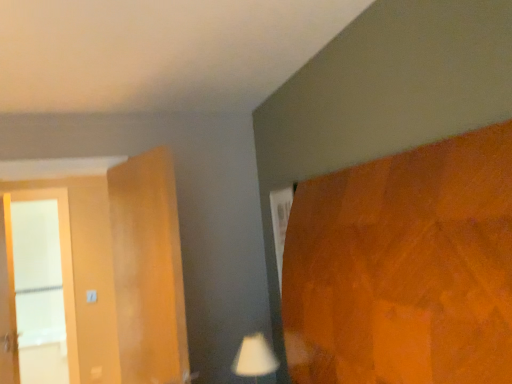
Find the location of `white matte table lamp at lower center`. white matte table lamp at lower center is located at coordinates (255, 357).

Describe the element at coordinates (255, 357) in the screenshot. I see `white matte table lamp at lower center` at that location.

Image resolution: width=512 pixels, height=384 pixels. Describe the element at coordinates (61, 264) in the screenshot. I see `white glass screen door at left` at that location.

This screenshot has height=384, width=512. What are the coordinates of `white glass screen door at left` in the screenshot? It's located at tap(61, 264).

Identify the location of white matte table lamp at lower center. (255, 357).

Considering the relative positions of white glass screen door at left and white matte table lamp at lower center in the image provided, is white glass screen door at left to the right of white matte table lamp at lower center from the viewer's perspective?

No, white glass screen door at left is not to the right of white matte table lamp at lower center.

Which object is further away from the camera taking this photo, white glass screen door at left or white matte table lamp at lower center?

white glass screen door at left is further away from the camera.

Which is closer, (76, 380) or (237, 373)?

Point (76, 380) is positioned farther from the camera compared to point (237, 373).

From the image's perspective, which is above, white glass screen door at left or white matte table lamp at lower center?

white glass screen door at left is shown above in the image.

From a real-world perspective, who is located lower, white glass screen door at left or white matte table lamp at lower center?

In real-world perspective, white matte table lamp at lower center is lower.

Looking at their sizes, would you say white glass screen door at left is wider or thinner than white matte table lamp at lower center?

white glass screen door at left is thinner than white matte table lamp at lower center.

Which of these two, white glass screen door at left or white matte table lamp at lower center, stands taller?

With more height is white glass screen door at left.

Is white glass screen door at left smaller than white matte table lamp at lower center?

Actually, white glass screen door at left might be larger than white matte table lamp at lower center.

From the picture: Which is correct: white glass screen door at left is inside white matte table lamp at lower center, or outside of it?

white glass screen door at left is outside white matte table lamp at lower center.

Is white glass screen door at left far away from white matte table lamp at lower center?

Yes, white glass screen door at left is far from white matte table lamp at lower center.

Is white matte table lamp at lower center at the back of white glass screen door at left?

No, white glass screen door at left is not facing away from white matte table lamp at lower center.

Measure the distance from white glass screen door at left to white matte table lamp at lower center.

They are 7.15 feet apart.

This screenshot has height=384, width=512. What are the coordinates of `table lamp beneath the white glass screen door at left (from a real-world perspective)` in the screenshot? It's located at (255, 357).

Considering the positions of objects white matte table lamp at lower center and white glass screen door at left in the image provided, who is more to the right, white matte table lamp at lower center or white glass screen door at left?

Result: white matte table lamp at lower center is more to the right.

In the image, is white matte table lamp at lower center positioned in front of or behind white glass screen door at left?

white matte table lamp at lower center is in front of white glass screen door at left.

Is point (242, 366) closer to viewer compared to point (68, 333)?

Yes, point (242, 366) is closer to viewer.

From the image's perspective, is white matte table lamp at lower center on white glass screen door at left?

No, from the image's perspective, white matte table lamp at lower center is not on top of white glass screen door at left.

From a real-world perspective, who is located lower, white matte table lamp at lower center or white glass screen door at left?

white matte table lamp at lower center.

Considering the sizes of white matte table lamp at lower center and white glass screen door at left in the image, is white matte table lamp at lower center wider or thinner than white glass screen door at left?

In the image, white matte table lamp at lower center appears to be wider than white glass screen door at left.

Is white matte table lamp at lower center taller or shorter than white glass screen door at left?

In the image, white matte table lamp at lower center appears to be shorter than white glass screen door at left.

Does white matte table lamp at lower center have a larger size compared to white glass screen door at left?

No, white matte table lamp at lower center is not bigger than white glass screen door at left.

From the picture: Would you say white matte table lamp at lower center is inside or outside white glass screen door at left?

white matte table lamp at lower center is located beyond the bounds of white glass screen door at left.

Is white matte table lamp at lower center positioned far away from white glass screen door at left?

white matte table lamp at lower center is far away from white glass screen door at left.

Is white matte table lamp at lower center oriented away from white glass screen door at left?

white matte table lamp at lower center does not have its back to white glass screen door at left.

How different are the orientations of white matte table lamp at lower center and white glass screen door at left in degrees?

90 degrees.

In order to click on table lamp on the right of white glass screen door at left in this screenshot , I will do `click(255, 357)`.

Locate an element on the screen. The width and height of the screenshot is (512, 384). table lamp lying in front of the white glass screen door at left is located at coordinates (255, 357).

Locate an element on the screen. This screenshot has height=384, width=512. screen door located above the white matte table lamp at lower center (from a real-world perspective) is located at coordinates (61, 264).